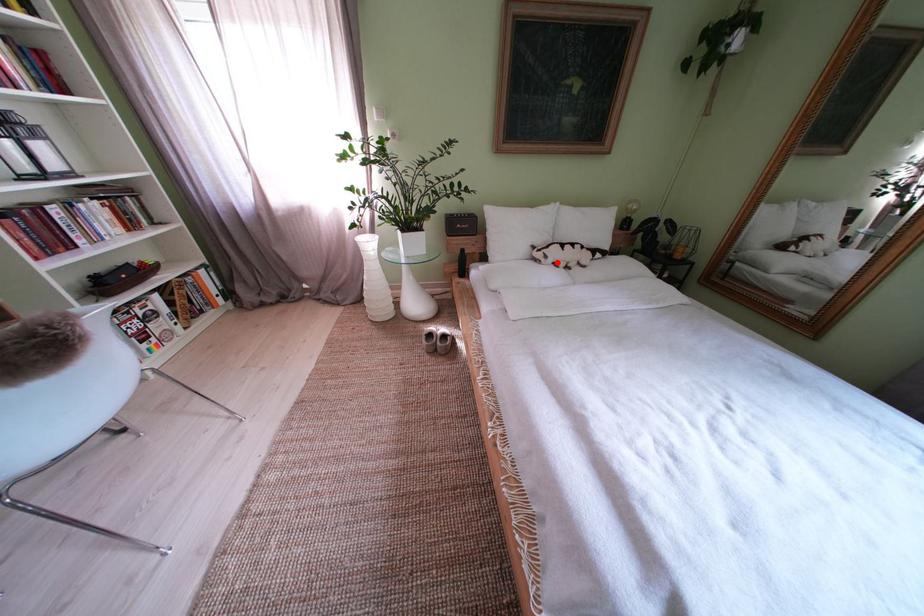
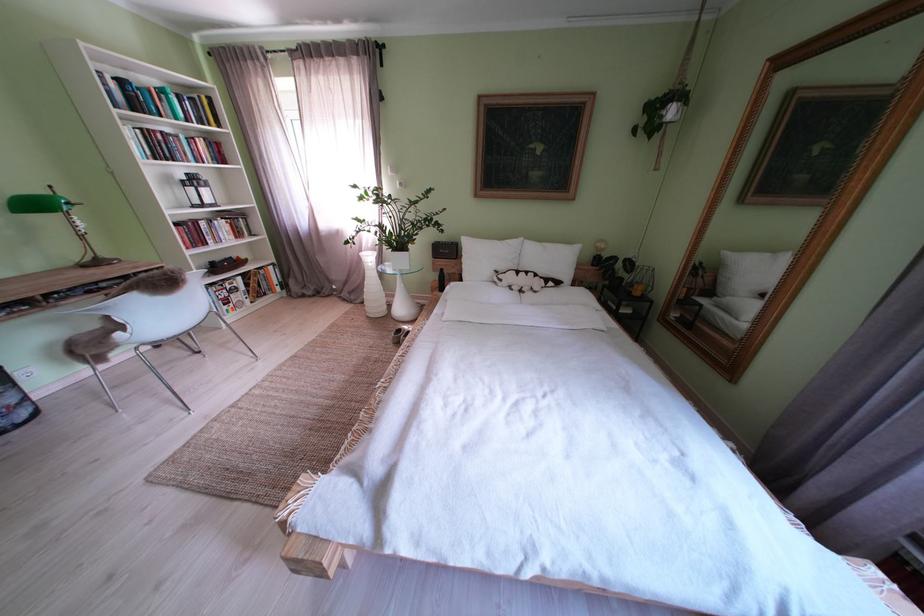
The point at the highlighted location is marked in the first image. Where is the corresponding point in the second image?

(512, 285)